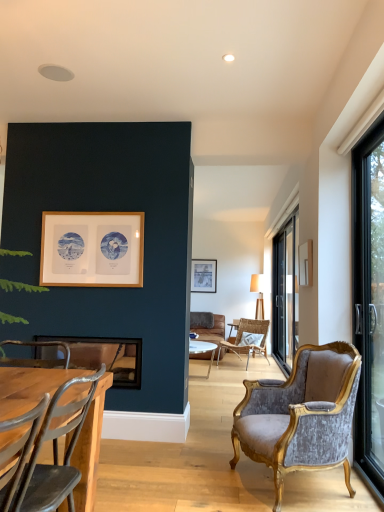
What do you see at coordinates (61, 414) in the screenshot? I see `metallic gray chair at lower left, acting as the 3th chair starting from the right` at bounding box center [61, 414].

Image resolution: width=384 pixels, height=512 pixels. In order to click on black glass door at right, acting as the 2th window starting from the back in this screenshot , I will do `click(369, 303)`.

Describe the element at coordinates (248, 339) in the screenshot. I see `woven rattan chair at center, which is counted as the 1th chair, starting from the right` at that location.

In order to face woven rattan chair at center, the 3th chair in the left-to-right sequence, should I rotate leftwards or rightwards?

It's best to rotate right around 7.264 degrees.

Find the location of a particular element. matte wooden picture frame at center, placed as the second picture frame when sorted from bottom to top is located at coordinates (204, 276).

Is wooden frame at upper left, the 2th picture frame when ordered from back to front, at the back of velvet/gold armchair at right, marked as the second chair in a right-to-left arrangement?

No, velvet/gold armchair at right, marked as the second chair in a right-to-left arrangement,'s orientation is not away from wooden frame at upper left, the 2th picture frame when ordered from back to front.

From the picture: From the image's perspective, which one is positioned higher, velvet/gold armchair at right, which is the 2th chair in back-to-front order, or wooden frame at upper left, which ranks as the second picture frame in front-to-back order?

wooden frame at upper left, which ranks as the second picture frame in front-to-back order, appears higher in the image.

Consider the image. Considering the relative sizes of black glass door at right, acting as the 2th window starting from the back, and woven rattan chair at center, which is counted as the 1th chair, starting from the right, in the image provided, is black glass door at right, acting as the 2th window starting from the back, smaller than woven rattan chair at center, which is counted as the 1th chair, starting from the right,?

Yes.

Based on the photo, from a real-world perspective, who is located lower, black glass door at right, which appears as the first window when viewed from the left, or woven rattan chair at center, placed as the third chair when sorted from front to back?

In real-world perspective, woven rattan chair at center, placed as the third chair when sorted from front to back, is lower.

Is black glass door at right, the 1th window viewed from the front, facing away from woven rattan chair at center, the 3th chair in the left-to-right sequence?

black glass door at right, the 1th window viewed from the front, does not have its back to woven rattan chair at center, the 3th chair in the left-to-right sequence.

Can you confirm if black glass door at right, the 1th window viewed from the front, is wider than woven rattan chair at center, which is counted as the 1th chair, starting from the right?

No, black glass door at right, the 1th window viewed from the front, is not wider than woven rattan chair at center, which is counted as the 1th chair, starting from the right.

From the image's perspective, is black glass door at right, marked as the second window in a front-to-back arrangement, beneath metallic gray chair at lower left, which is the third chair in back-to-front order?

No, from the image's perspective, black glass door at right, marked as the second window in a front-to-back arrangement, is not beneath metallic gray chair at lower left, which is the third chair in back-to-front order.

From their relative heights in the image, would you say black glass door at right, marked as the second window in a front-to-back arrangement, is taller or shorter than metallic gray chair at lower left, acting as the 3th chair starting from the right?

In the image, black glass door at right, marked as the second window in a front-to-back arrangement, appears to be taller than metallic gray chair at lower left, acting as the 3th chair starting from the right.

Considering the relative positions of black glass door at right, placed as the first window when sorted from back to front, and metallic gray chair at lower left, which is counted as the 1th chair, starting from the front, in the image provided, is black glass door at right, placed as the first window when sorted from back to front, to the left or to the right of metallic gray chair at lower left, which is counted as the 1th chair, starting from the front,?

black glass door at right, placed as the first window when sorted from back to front, is to the right of metallic gray chair at lower left, which is counted as the 1th chair, starting from the front.

Is black glass door at right, marked as the second window in a front-to-back arrangement, placed right next to metallic gray chair at lower left, acting as the 3th chair starting from the right?

No, black glass door at right, marked as the second window in a front-to-back arrangement, is not beside metallic gray chair at lower left, acting as the 3th chair starting from the right.

Looking at this image, from the image's perspective, is black glass door at right, the 2th window in the left-to-right sequence, over matte wooden picture frame at center, the 1th picture frame in the back-to-front sequence?

No, from the image's perspective, black glass door at right, the 2th window in the left-to-right sequence, is not over matte wooden picture frame at center, the 1th picture frame in the back-to-front sequence.

Which is closer, [278,237] or [197,276]?

Point [278,237].

Identify the location of window that is below the matte wooden picture frame at center, the 1th picture frame in the back-to-front sequence (from the image's perspective). The height and width of the screenshot is (512, 384). (285, 294).

From a real-world perspective, does black glass door at right, the 1th window in the right-to-left sequence, stand above matte wooden picture frame at center, placed as the second picture frame when sorted from bottom to top?

No.

Between matte wooden picture frame at center, the 3th picture frame positioned from the front, and black glass door at right, which appears as the first window when viewed from the left, which one has less height?

matte wooden picture frame at center, the 3th picture frame positioned from the front.

Looking at this image, is matte wooden picture frame at center, placed as the second picture frame when sorted from bottom to top, looking in the opposite direction of black glass door at right, acting as the 2th window starting from the back?

matte wooden picture frame at center, placed as the second picture frame when sorted from bottom to top, does not have its back to black glass door at right, acting as the 2th window starting from the back.

Based on the photo, does matte wooden picture frame at center, positioned as the 2th picture frame in top-to-bottom order, come behind black glass door at right, which is counted as the 2th window, starting from the right?

Yes.

Consider the image. Is matte wooden picture frame at center, the 1th picture frame in the back-to-front sequence, positioned far away from black glass door at right, which is counted as the 2th window, starting from the right?

matte wooden picture frame at center, the 1th picture frame in the back-to-front sequence, is far away from black glass door at right, which is counted as the 2th window, starting from the right.

From the picture: Is black glass screen door at right taller or shorter than wooden frame at upper left, which ranks as the second picture frame in front-to-back order?

black glass screen door at right is taller than wooden frame at upper left, which ranks as the second picture frame in front-to-back order.

Is black glass screen door at right aimed at wooden frame at upper left, which ranks as the second picture frame in front-to-back order?

No, black glass screen door at right is not aimed at wooden frame at upper left, which ranks as the second picture frame in front-to-back order.

Looking at this image, which is closer to the camera, (x=280, y=255) or (x=123, y=250)?

Positioned in front is point (x=123, y=250).

From a real-world perspective, does black glass screen door at right sit lower than wooden frame at upper left, which ranks as the second picture frame in front-to-back order?

Yes, from a real-world perspective, black glass screen door at right is below wooden frame at upper left, which ranks as the second picture frame in front-to-back order.

Looking at this image, from the image's perspective, is woven rattan chair at center, the first chair positioned from the back, under metallic silver picture frame at lower left, positioned as the first picture frame in bottom-to-top order?

Correct, woven rattan chair at center, the first chair positioned from the back, appears lower than metallic silver picture frame at lower left, positioned as the first picture frame in bottom-to-top order, in the image.

Which is further, (x=268, y=324) or (x=36, y=355)?

The point (x=268, y=324) is farther from the camera.

Where is `the 3rd picture frame positioned above the velvet/gold armchair at right, which is the 2th chair in back-to-front order (from the image's perspective)`? Image resolution: width=384 pixels, height=512 pixels. the 3rd picture frame positioned above the velvet/gold armchair at right, which is the 2th chair in back-to-front order (from the image's perspective) is located at coordinates (92, 249).

Locate an element on the screen. This screenshot has height=512, width=384. the 3rd chair below the black glass door at right, acting as the 2th window starting from the back (from the image's perspective) is located at coordinates (248, 339).

Based on their spatial positions, is velvet/gold armchair at right, which is the 2th chair from left to right, or metallic gray chair at lower left, acting as the 3th chair starting from the right, closer to wooden frame at upper left, which ranks as the second picture frame in front-to-back order?

The object closer to wooden frame at upper left, which ranks as the second picture frame in front-to-back order, is metallic gray chair at lower left, acting as the 3th chair starting from the right.

From the picture: From the image, which object appears to be farther from woven rattan chair at center, placed as the third chair when sorted from front to back, wooden frame at upper left, the third picture frame positioned from the bottom, or matte wooden picture frame at center, the 1th picture frame in the back-to-front sequence?

The object further to woven rattan chair at center, placed as the third chair when sorted from front to back, is wooden frame at upper left, the third picture frame positioned from the bottom.

From the image, which object appears to be nearer to black glass screen door at right, metallic gray chair at lower left, which is the third chair in back-to-front order, or velvet/gold armchair at right, marked as the second chair in a right-to-left arrangement?

Based on the image, velvet/gold armchair at right, marked as the second chair in a right-to-left arrangement, appears to be nearer to black glass screen door at right.

Looking at the image, which one is located closer to woven rattan chair at center, the 3th chair in the left-to-right sequence, black glass screen door at right or metallic gray chair at lower left, which is the third chair in back-to-front order?

black glass screen door at right is closer to woven rattan chair at center, the 3th chair in the left-to-right sequence.

Looking at this image, considering their positions, is black glass door at right, marked as the second window in a front-to-back arrangement, positioned closer to black glass screen door at right than wooden frame at upper left, which ranks as the second picture frame in front-to-back order?

black glass door at right, marked as the second window in a front-to-back arrangement, is closer to black glass screen door at right.

When comparing their distances from black glass door at right, the 2th window in the left-to-right sequence, does woven rattan chair at center, the first chair positioned from the back, or metallic gray chair at lower left, which is the third chair in back-to-front order, seem further?

metallic gray chair at lower left, which is the third chair in back-to-front order, is further to black glass door at right, the 2th window in the left-to-right sequence.

Considering their positions, is metallic silver picture frame at lower left, positioned as the first picture frame in bottom-to-top order, positioned further to wooden frame at upper left, the 2th picture frame when ordered from back to front, than metallic gray chair at lower left, which is counted as the 1th chair, starting from the front?

metallic gray chair at lower left, which is counted as the 1th chair, starting from the front.

Based on their spatial positions, is wooden frame at upper left, which ranks as the second picture frame in front-to-back order, or black glass door at right, the 2th window in the left-to-right sequence, closer to metallic gray chair at lower left, which is the third chair in back-to-front order?

wooden frame at upper left, which ranks as the second picture frame in front-to-back order, lies closer to metallic gray chair at lower left, which is the third chair in back-to-front order, than the other object.

Where is `picture frame located between metallic silver picture frame at lower left, marked as the third picture frame in a top-to-bottom arrangement, and matte wooden picture frame at center, the 1th picture frame in the back-to-front sequence, in the depth direction`? picture frame located between metallic silver picture frame at lower left, marked as the third picture frame in a top-to-bottom arrangement, and matte wooden picture frame at center, the 1th picture frame in the back-to-front sequence, in the depth direction is located at coordinates (92, 249).

Identify the location of chair between metallic silver picture frame at lower left, which is the first picture frame from front to back, and black glass screen door at right, along the z-axis. The width and height of the screenshot is (384, 512). (248, 339).

The width and height of the screenshot is (384, 512). I want to click on window located between black glass door at right, acting as the 2th window starting from the back, and black glass screen door at right in the depth direction, so click(285, 294).

This screenshot has width=384, height=512. What are the coordinates of `chair positioned between wooden frame at upper left, the 1th picture frame in the top-to-bottom sequence, and black glass door at right, placed as the first window when sorted from back to front, from near to far` in the screenshot? It's located at (248, 339).